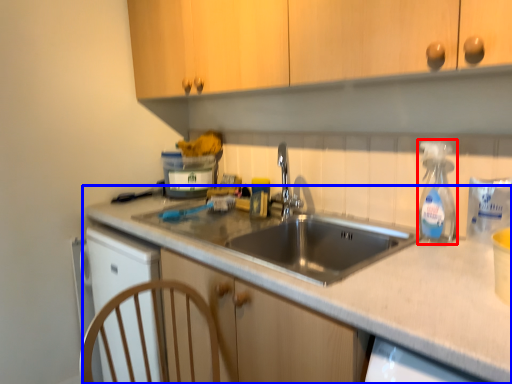
Question: Which point is further to the camera, soap dispenser (highlighted by a red box) or countertop (highlighted by a blue box)?

Choices:
 (A) soap dispenser
 (B) countertop

Answer: (A)